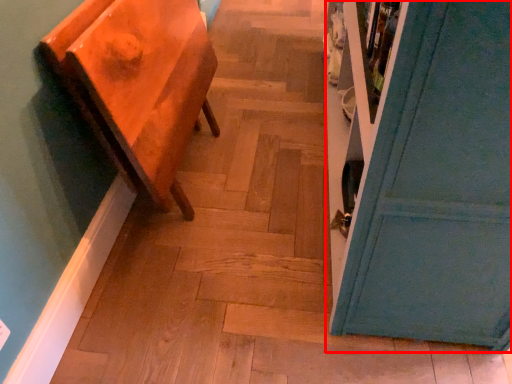
Question: In this image, where is door (annotated by the red box) located relative to furniture?

Choices:
 (A) right
 (B) left

Answer: (A)